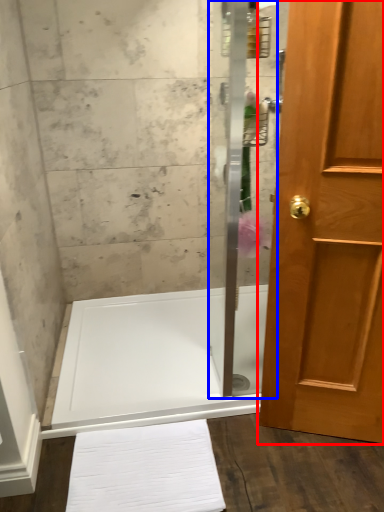
Question: Among these objects, which one is farthest to the camera, door (highlighted by a red box) or shower door (highlighted by a blue box)?

Choices:
 (A) door
 (B) shower door

Answer: (B)